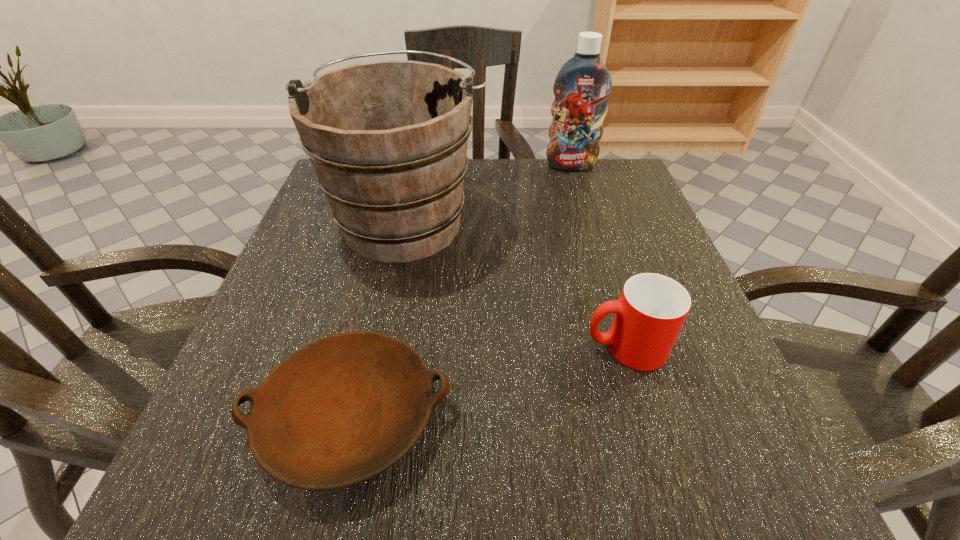
At what (x,y) coordinates should I click in order to perform the action: click on shampoo. Please return your answer as a coordinate pair (x, y). The image size is (960, 540). Looking at the image, I should click on (583, 84).

The width and height of the screenshot is (960, 540). In order to click on the second farthest object in this screenshot , I will do `click(388, 140)`.

You are a GUI agent. You are given a task and a screenshot of the screen. Output one action in this format:
    pyautogui.click(x=<x>, y=<y>)
    Task: Click on the cup
    Image resolution: width=960 pixels, height=540 pixels.
    Given the screenshot: What is the action you would take?
    pyautogui.click(x=652, y=308)

Where is `the shortest object`? the shortest object is located at coordinates [x=342, y=409].

The width and height of the screenshot is (960, 540). What are the coordinates of `free spot located 0.390m on the front label of the shampoo` in the screenshot? It's located at (606, 282).

At what (x,y) coordinates should I click in order to perform the action: click on vacant space situated on the side of the second shortest object with the handle. Please return your answer as a coordinate pair (x, y). Looking at the image, I should click on (405, 348).

What are the coordinates of `vacant space located on the side of the second shortest object with the handle` in the screenshot? It's located at (463, 348).

You are a GUI agent. You are given a task and a screenshot of the screen. Output one action in this format:
    pyautogui.click(x=<x>, y=<y>)
    Task: Click on the vacant space located 0.150m on the side of the second shortest object with the handle
    
    Given the screenshot: What is the action you would take?
    pyautogui.click(x=489, y=348)

Locate an element on the screen. Image resolution: width=960 pixels, height=540 pixels. vacant area situated 0.320m on the right of the plate is located at coordinates (684, 417).

Where is `shampoo that is at the far edge`? The height and width of the screenshot is (540, 960). shampoo that is at the far edge is located at coordinates tap(583, 84).